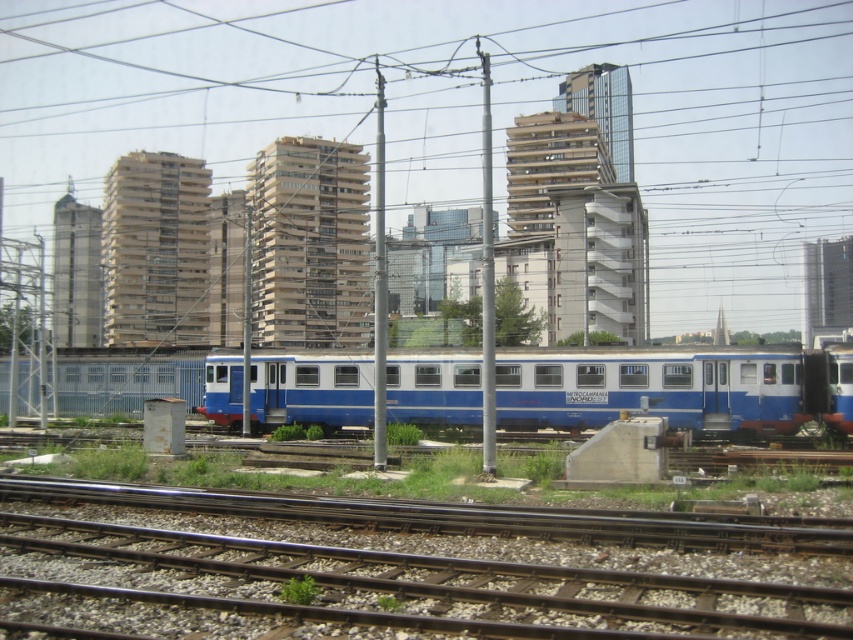
Question: Is smooth steel tracks at center above blue/white passenger train at center?

Choices:
 (A) yes
 (B) no

Answer: (B)

Question: Observing the image, what is the correct spatial positioning of smooth steel tracks at center in reference to blue/white passenger train at center?

Choices:
 (A) right
 (B) left

Answer: (B)

Question: In this image, where is smooth steel tracks at center located relative to blue/white passenger train at center?

Choices:
 (A) right
 (B) left

Answer: (B)

Question: Which of the following is the farthest from the observer?

Choices:
 (A) smooth steel tracks at center
 (B) blue/white passenger train at center

Answer: (B)